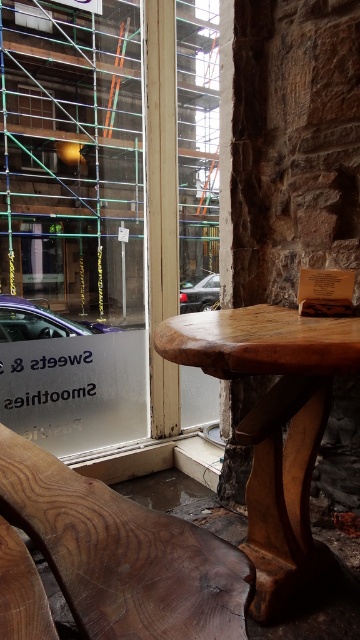
Who is positioned more to the left, transparent glass door at left or wooden chair at lower left?

transparent glass door at left

Identify the location of transparent glass door at left. This screenshot has height=640, width=360. (73, 221).

The height and width of the screenshot is (640, 360). In order to click on transparent glass door at left in this screenshot , I will do `click(73, 221)`.

Does wooden chair at lower left have a greater height compared to smooth wood table at center?

In fact, wooden chair at lower left may be shorter than smooth wood table at center.

Is wooden chair at lower left positioned at the back of smooth wood table at center?

That is False.

Who is more forward, [231,588] or [334,332]?

Point [231,588]

The image size is (360, 640). I want to click on wooden chair at lower left, so click(x=123, y=554).

Does transparent glass door at left appear over smooth wood table at center?

Correct, transparent glass door at left is located above smooth wood table at center.

Is transparent glass door at left taller than smooth wood table at center?

Indeed, transparent glass door at left has a greater height compared to smooth wood table at center.

The height and width of the screenshot is (640, 360). In order to click on transparent glass door at left in this screenshot , I will do `click(73, 221)`.